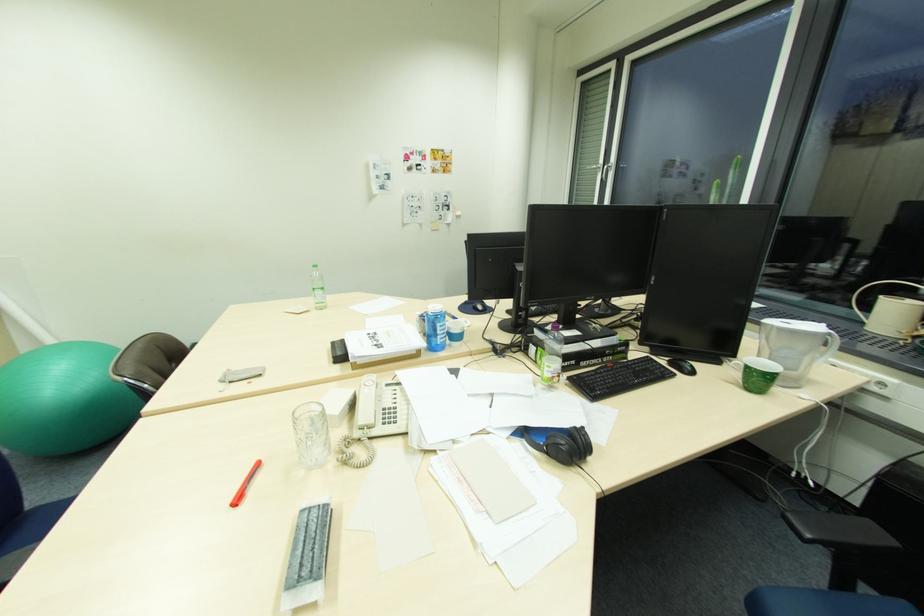
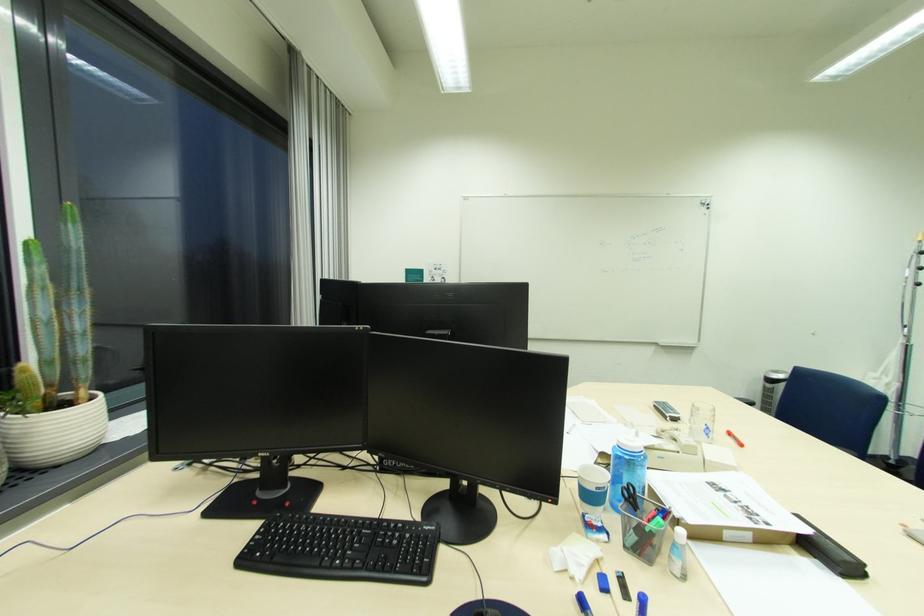
Find the pixel in the second image that matches (382,345) in the first image.

(731, 491)